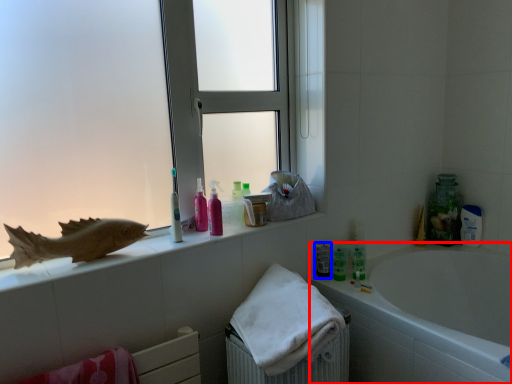
Question: Among these objects, which one is nearest to the camera, bathtub (highlighted by a red box) or mouthwash (highlighted by a blue box)?

Choices:
 (A) bathtub
 (B) mouthwash

Answer: (A)